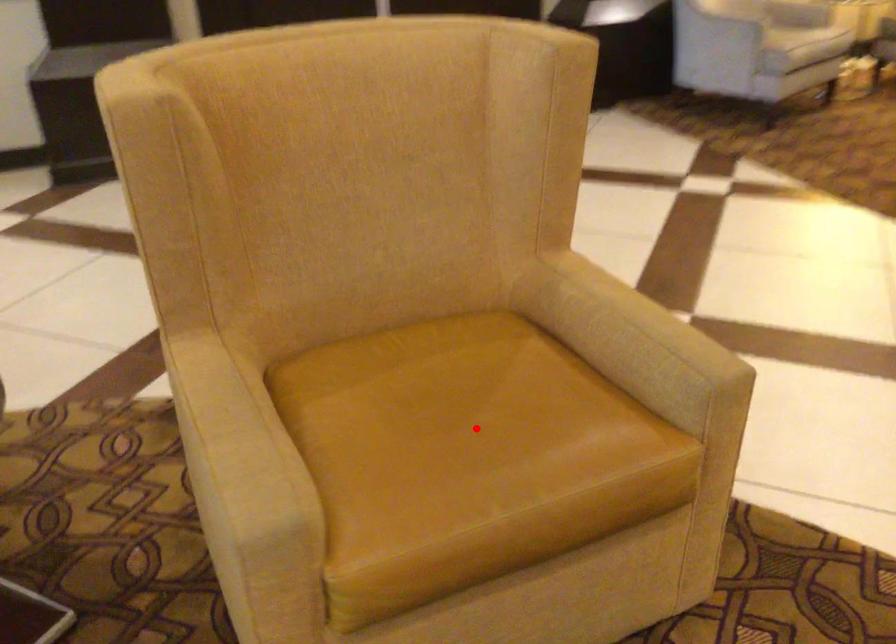
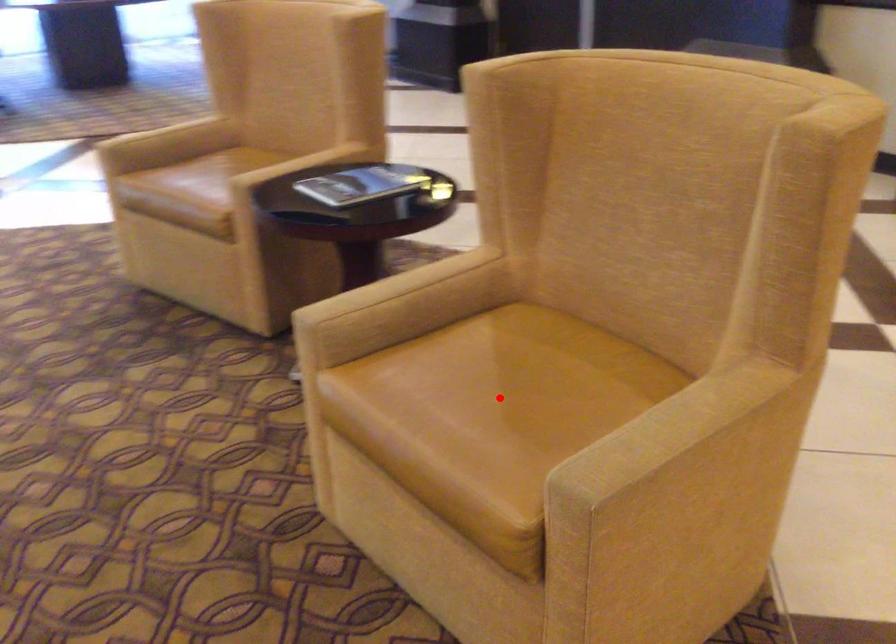
I am providing you with two images of the same scene from different viewpoints. A red point is marked on the first image and another point is marked on the second image. Is the red point in image1 aligned with the point shown in image2?

Yes